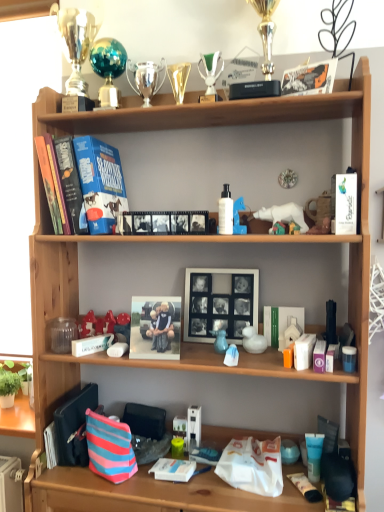
The height and width of the screenshot is (512, 384). Describe the element at coordinates (109, 448) in the screenshot. I see `striped fabric pouch at lower left` at that location.

Identify the location of shiny red plastic toy at center, acting as the fifth toy starting from the top. This screenshot has height=512, width=384. [106, 325].

What do you see at coordinates (225, 212) in the screenshot? I see `white glossy lotion at center, which is the fourth toiletry in bottom-to-top order` at bounding box center [225, 212].

The image size is (384, 512). Identify the location of white matte book at center, the first book positioned from the top. (280, 323).

How many degrees apart are the facing directions of hardcover book at lower left, marked as the first book in a left-to-right arrangement, and hardcover book at upper left, which is the second paperback book in front-to-back order?

The angular difference between hardcover book at lower left, marked as the first book in a left-to-right arrangement, and hardcover book at upper left, which is the second paperback book in front-to-back order, is 1.58 degrees.

Considering the sizes of objects hardcover book at lower left, acting as the 2th book starting from the top, and hardcover book at upper left, the first paperback book in the left-to-right sequence, in the image provided, who is shorter, hardcover book at lower left, acting as the 2th book starting from the top, or hardcover book at upper left, the first paperback book in the left-to-right sequence,?

Standing shorter between the two is hardcover book at lower left, acting as the 2th book starting from the top.

Looking at this image, which of these two, hardcover book at lower left, marked as the first book in a left-to-right arrangement, or hardcover book at upper left, which is the second paperback book in front-to-back order, is wider?

With larger width is hardcover book at upper left, which is the second paperback book in front-to-back order.

From a real-world perspective, which is physically below, hardcover book at lower left, marked as the first book in a left-to-right arrangement, or hardcover book at upper left, the first paperback book in the left-to-right sequence?

From a 3D spatial view, hardcover book at lower left, marked as the first book in a left-to-right arrangement, is below.

Which point is more distant from viewer, [218,59] or [117,469]?

Point [218,59]

Is green plastic trophy at upper center, marked as the seventh toy in a bottom-to-top arrangement, positioned with its back to striped fabric pouch at lower left?

That's not correct — green plastic trophy at upper center, marked as the seventh toy in a bottom-to-top arrangement, is not looking away from striped fabric pouch at lower left.

Consider the image. From the image's perspective, is green plastic trophy at upper center, positioned as the 5th toy in right-to-left order, located above or below striped fabric pouch at lower left?

Clearly, from the image's perspective, green plastic trophy at upper center, positioned as the 5th toy in right-to-left order, is above striped fabric pouch at lower left.

Considering the positions of objects green plastic trophy at upper center, placed as the second toy when sorted from top to bottom, and striped fabric pouch at lower left in the image provided, who is in front, green plastic trophy at upper center, placed as the second toy when sorted from top to bottom, or striped fabric pouch at lower left?

striped fabric pouch at lower left is in front.

Is matte blue rubber duck at middle, the seventh toy positioned from the top, wider or thinner than white matte picture frame at center?

Considering their sizes, matte blue rubber duck at middle, the seventh toy positioned from the top, looks slimmer than white matte picture frame at center.

Considering the relative sizes of matte blue rubber duck at middle, the seventh toy positioned from the top, and white matte picture frame at center in the image provided, is matte blue rubber duck at middle, the seventh toy positioned from the top, bigger than white matte picture frame at center?

Actually, matte blue rubber duck at middle, the seventh toy positioned from the top, might be smaller than white matte picture frame at center.

Measure the distance from matte blue rubber duck at middle, which is the 2th toy in bottom-to-top order, to white matte picture frame at center.

matte blue rubber duck at middle, which is the 2th toy in bottom-to-top order, is 5.02 inches away from white matte picture frame at center.

From a real-world perspective, is matte blue rubber duck at middle, which is the 2th toy in bottom-to-top order, located beneath white matte picture frame at center?

Yes, from a real-world perspective, matte blue rubber duck at middle, which is the 2th toy in bottom-to-top order, is under white matte picture frame at center.

Is shiny red plastic toy at center, which is the first toy in left-to-right order, oriented towards white matte paperback book at upper right, the 2th paperback book positioned from the left?

No, shiny red plastic toy at center, which is the first toy in left-to-right order, is not turned towards white matte paperback book at upper right, the 2th paperback book positioned from the left.

Considering the sizes of shiny red plastic toy at center, which is the first toy in left-to-right order, and white matte paperback book at upper right, the second paperback book in the back-to-front sequence, in the image, is shiny red plastic toy at center, which is the first toy in left-to-right order, bigger or smaller than white matte paperback book at upper right, the second paperback book in the back-to-front sequence,?

Considering their sizes, shiny red plastic toy at center, which is the first toy in left-to-right order, takes up more space than white matte paperback book at upper right, the second paperback book in the back-to-front sequence.

Does shiny red plastic toy at center, the fourth toy ordered from the bottom, touch white matte paperback book at upper right, placed as the first paperback book when sorted from right to left?

No, shiny red plastic toy at center, the fourth toy ordered from the bottom, is not in contact with white matte paperback book at upper right, placed as the first paperback book when sorted from right to left.

From the image's perspective, which is below, shiny red plastic toy at center, which is the first toy in left-to-right order, or white matte paperback book at upper right, the second paperback book in the back-to-front sequence?

shiny red plastic toy at center, which is the first toy in left-to-right order.

Is point (152, 305) positioned before point (122, 52)?

Yes, point (152, 305) is closer to viewer.

Based on the photo, is matte plastic photo frame at center surrounding shiny teal sphere at upper center, which ranks as the first toy in top-to-bottom order?

No.

Could you tell me if matte plastic photo frame at center is facing shiny teal sphere at upper center, which is the seventh toy from right to left?

No, matte plastic photo frame at center is not oriented towards shiny teal sphere at upper center, which is the seventh toy from right to left.

From the image's perspective, between matte plastic photo frame at center and shiny teal sphere at upper center, positioned as the 2th toy in left-to-right order, who is located below?

matte plastic photo frame at center.

Is white plastic duck at center, the 3th toy positioned from the right, far away from silver metallic trophy at upper left?

Yes.

From the picture: Is white plastic duck at center, positioned as the eighth toy in top-to-bottom order, in front of or behind silver metallic trophy at upper left in the image?

white plastic duck at center, positioned as the eighth toy in top-to-bottom order, is positioned closer to the viewer than silver metallic trophy at upper left.

From the image's perspective, is white plastic duck at center, which appears as the 1th toy when ordered from the bottom, beneath silver metallic trophy at upper left?

Indeed, from the image's perspective, white plastic duck at center, which appears as the 1th toy when ordered from the bottom, is shown beneath silver metallic trophy at upper left.

From the image's perspective, which object appears higher, hardcover book at upper left, which is the second paperback book in front-to-back order, or shiny teal sphere at upper center, which ranks as the first toy in top-to-bottom order?

shiny teal sphere at upper center, which ranks as the first toy in top-to-bottom order, is shown above in the image.

Image resolution: width=384 pixels, height=512 pixels. I want to click on the 3rd toy above when counting from the hardcover book at upper left, which is the 2th paperback book from right to left (from the image's perspective), so click(108, 69).

Is hardcover book at upper left, positioned as the first paperback book in back-to-front order, not inside shiny teal sphere at upper center, positioned as the 2th toy in left-to-right order?

hardcover book at upper left, positioned as the first paperback book in back-to-front order, is positioned outside shiny teal sphere at upper center, positioned as the 2th toy in left-to-right order.

Identify the location of the 1st book behind the hardcover book at upper left, which is the 2th paperback book from right to left. click(x=51, y=445).

The height and width of the screenshot is (512, 384). Identify the location of shopping bag on the left of green plastic trophy at upper center, positioned as the 5th toy in right-to-left order. (109, 448).

Based on their spatial positions, is green plastic trophy at upper center, marked as the seventh toy in a bottom-to-top arrangement, or hardcover book at upper left, positioned as the first paperback book in back-to-front order, further from blue matte tube at lower right, positioned as the 4th toiletry in left-to-right order?

green plastic trophy at upper center, marked as the seventh toy in a bottom-to-top arrangement, is positioned further to the anchor blue matte tube at lower right, positioned as the 4th toiletry in left-to-right order.

From the image, which object appears to be nearer to hardcover book at upper left, which is the 2th paperback book from right to left, green plastic trophy at upper center, the 4th toy positioned from the left, or shiny teal sphere at upper center, the 8th toy when ordered from bottom to top?

The object closer to hardcover book at upper left, which is the 2th paperback book from right to left, is shiny teal sphere at upper center, the 8th toy when ordered from bottom to top.

From the image, which object appears to be farther from purple matte tube at middle right, which is counted as the 3th toiletry, starting from the left, white matte picture frame at center or striped fabric pouch at lower left?

Among the two, striped fabric pouch at lower left is located further to purple matte tube at middle right, which is counted as the 3th toiletry, starting from the left.

From the image, which object appears to be nearer to white matte picture frame at center, shiny teal sphere at upper center, which ranks as the first toy in top-to-bottom order, or hardcover book at upper left, the first paperback book in the left-to-right sequence?

Based on the image, hardcover book at upper left, the first paperback book in the left-to-right sequence, appears to be nearer to white matte picture frame at center.

Looking at the image, which one is located further to shiny red plastic toy at center, the fourth toy ordered from the bottom, matte plastic photo frame at center or white matte book at center, positioned as the second book in bottom-to-top order?

white matte book at center, positioned as the second book in bottom-to-top order, lies further to shiny red plastic toy at center, the fourth toy ordered from the bottom, than the other object.

Based on their spatial positions, is shiny teal sphere at upper center, which ranks as the first toy in top-to-bottom order, or hardcover book at upper left, which is the 2th paperback book from right to left, closer to matte brown figurine at upper right, positioned as the 8th toy in left-to-right order?

hardcover book at upper left, which is the 2th paperback book from right to left, lies closer to matte brown figurine at upper right, positioned as the 8th toy in left-to-right order, than the other object.

Considering their positions, is hardcover book at lower left, acting as the 2th book starting from the top, positioned closer to shiny red plastic toy at center, the fourth toy ordered from the bottom, than shiny teal sphere at upper center, the 8th toy when ordered from bottom to top?

hardcover book at lower left, acting as the 2th book starting from the top, is closer to shiny red plastic toy at center, the fourth toy ordered from the bottom.

Based on their spatial positions, is striped fabric pouch at lower left or shiny red plastic toy at center, arranged as the 8th toy when viewed from the right, closer to white matte picture frame at center?

The object closer to white matte picture frame at center is shiny red plastic toy at center, arranged as the 8th toy when viewed from the right.

Where is `book cover located between shiny red plastic toy at center, acting as the fifth toy starting from the top, and white glossy lotion at center, which is the 4th toiletry from right to left, in the left-right direction`? Image resolution: width=384 pixels, height=512 pixels. book cover located between shiny red plastic toy at center, acting as the fifth toy starting from the top, and white glossy lotion at center, which is the 4th toiletry from right to left, in the left-right direction is located at coordinates (155, 328).

The height and width of the screenshot is (512, 384). Identify the location of picture frame located between hardcover book at lower left, marked as the first book in a left-to-right arrangement, and white plastic duck at center, positioned as the eighth toy in top-to-bottom order, in the left-right direction. (220, 303).

Find the location of a particular element. This screenshot has height=512, width=384. book cover between shiny teal sphere at upper center, the 8th toy when ordered from bottom to top, and hardcover book at lower left, which appears as the 2th book when viewed from the right, from top to bottom is located at coordinates coord(155,328).

Where is `picture frame between green plastic trophy at upper center, placed as the second toy when sorted from top to bottom, and striped fabric pouch at lower left, in the vertical direction`? picture frame between green plastic trophy at upper center, placed as the second toy when sorted from top to bottom, and striped fabric pouch at lower left, in the vertical direction is located at coordinates (220, 303).